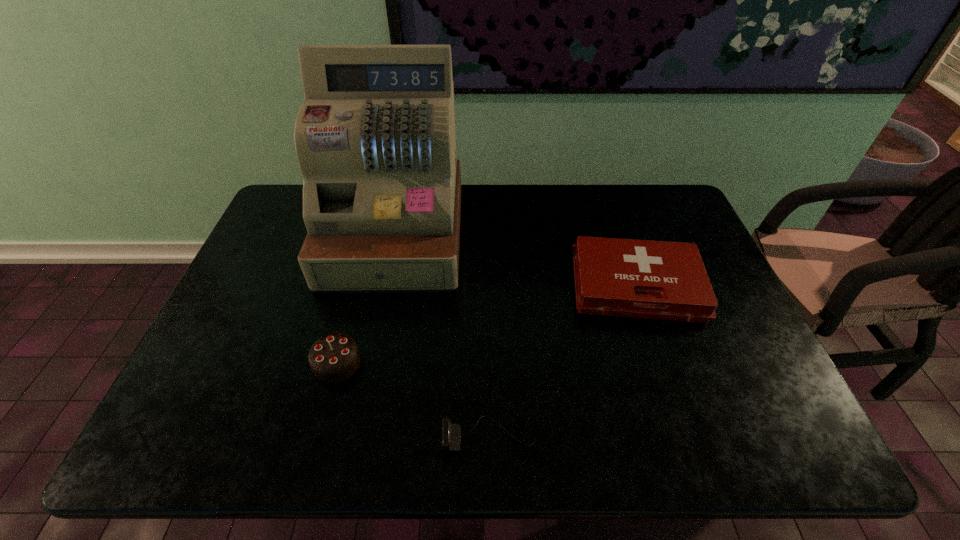
Identify the location of free space at the far left corner. The image size is (960, 540). (295, 210).

Where is `vacant space at the near right corner of the desktop`? vacant space at the near right corner of the desktop is located at coordinates (742, 416).

I want to click on free space between the tallest object and the chocolate cake, so click(x=366, y=299).

You are a GUI agent. You are given a task and a screenshot of the screen. Output one action in this format:
    pyautogui.click(x=<x>, y=<y>)
    Task: Click on the free space between the tallest object and the first-aid kit
    
    Given the screenshot: What is the action you would take?
    pyautogui.click(x=516, y=261)

You are a GUI agent. You are given a task and a screenshot of the screen. Output one action in this format:
    pyautogui.click(x=<x>, y=<y>)
    Task: Click on the free spot between the cash register and the rightmost object
    The width and height of the screenshot is (960, 540).
    Given the screenshot: What is the action you would take?
    pyautogui.click(x=516, y=261)

You are a GUI agent. You are given a task and a screenshot of the screen. Output one action in this format:
    pyautogui.click(x=<x>, y=<y>)
    Task: Click on the vacant region between the second shortest object and the tallest object
    The image size is (960, 540).
    Given the screenshot: What is the action you would take?
    pyautogui.click(x=516, y=261)

You are a GUI agent. You are given a task and a screenshot of the screen. Output one action in this format:
    pyautogui.click(x=<x>, y=<y>)
    Task: Click on the free spot between the cash register and the second nearest object
    
    Given the screenshot: What is the action you would take?
    pyautogui.click(x=366, y=299)

Locate an element on the screen. The height and width of the screenshot is (540, 960). free spot between the rightmost object and the nearest object is located at coordinates (563, 361).

The height and width of the screenshot is (540, 960). Identify the location of free space between the webcam and the rightmost object. (563, 361).

At what (x,y) coordinates should I click in order to perform the action: click on unoccupied position between the shortest object and the tallest object. Please return your answer as a coordinate pair (x, y). Looking at the image, I should click on (442, 336).